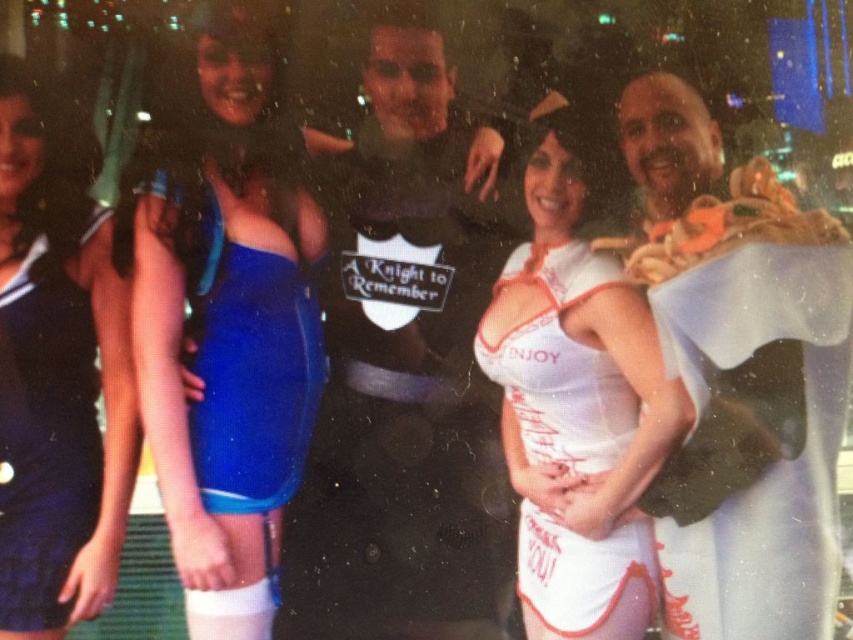
You are standing in the same scene as the group of people. There are two points marked in the image. One is located at point coordinates point (730, 252) and the other at point (287, 435). Which of these two points is closer to you?

The point at coordinates point (730, 252) is closer to the viewer than point (287, 435).

You are a photographer trying to capture a clear shot of both the white fabric at right and the blue fabric dress at center. Which one should you focus on first to ensure both are in focus?

The white fabric at right is closer to the viewer than the blue fabric dress at center. To ensure both are in focus, focus on the white fabric at right first, as it is closer, and the depth of field will likely extend to the blue fabric dress at center.